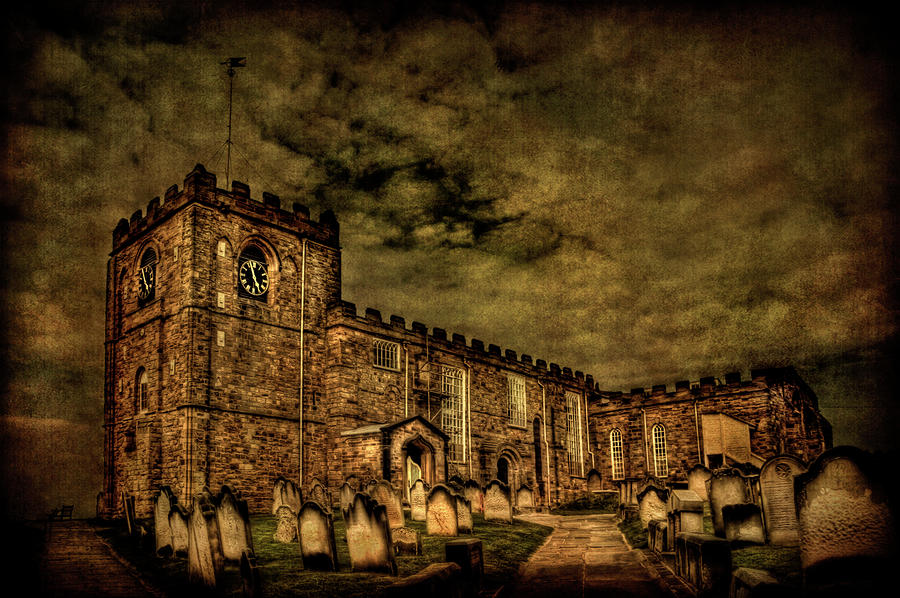
In order to click on doors in this screenshot , I will do tap(411, 469), tap(505, 471).